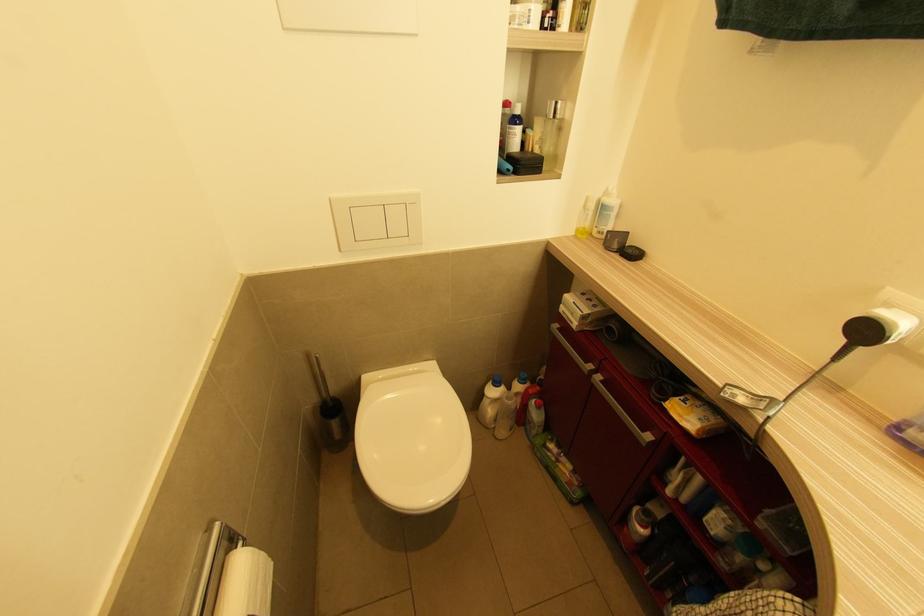
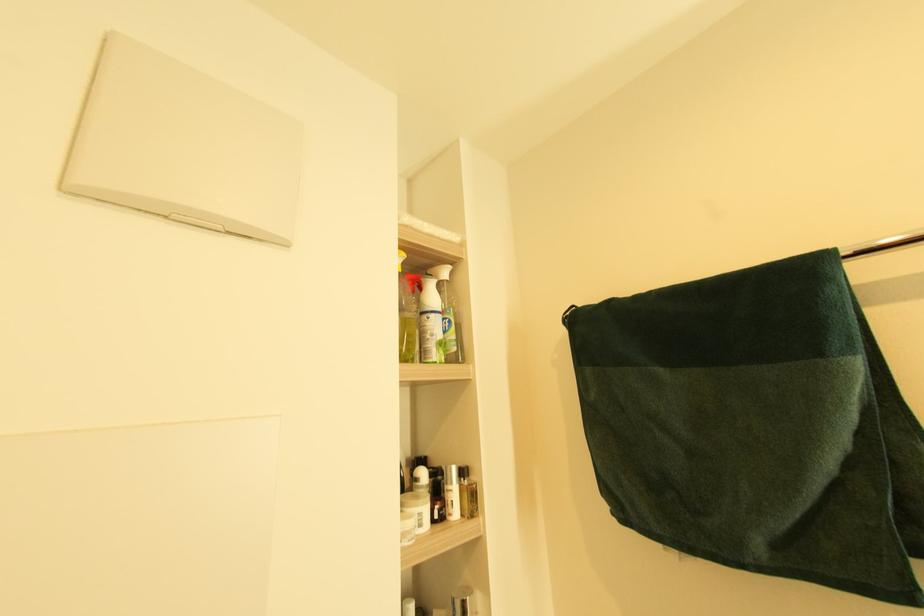
How did the camera likely rotate?

The camera rotated toward right-up.